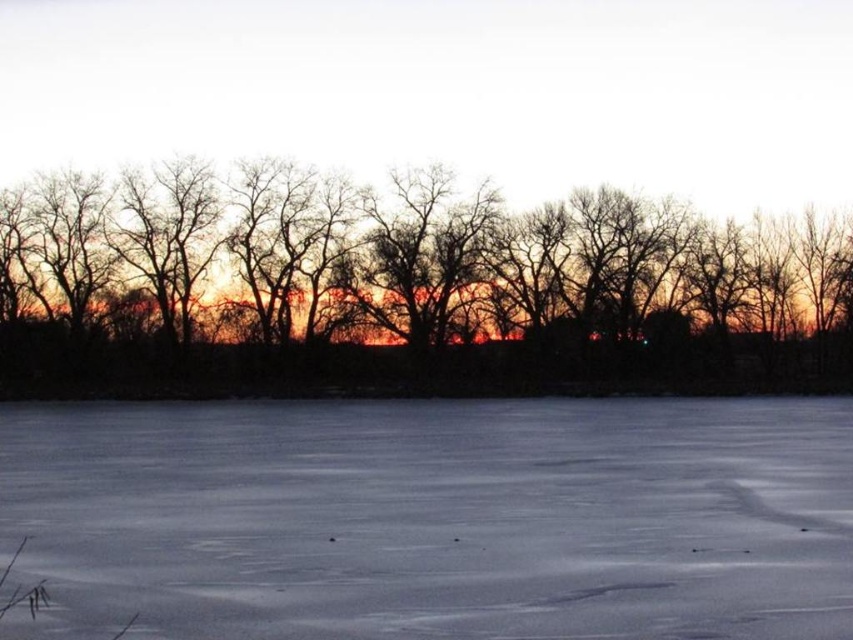
Is point (119, 404) farther from camera compared to point (426, 237)?

That is False.

Can you confirm if white smooth snow at center is positioned below black matte trees at center?

Yes, white smooth snow at center is below black matte trees at center.

Does point (216, 464) come closer to viewer compared to point (138, 285)?

That is True.

The image size is (853, 640). Find the location of `white smooth snow at center`. white smooth snow at center is located at coordinates (437, 518).